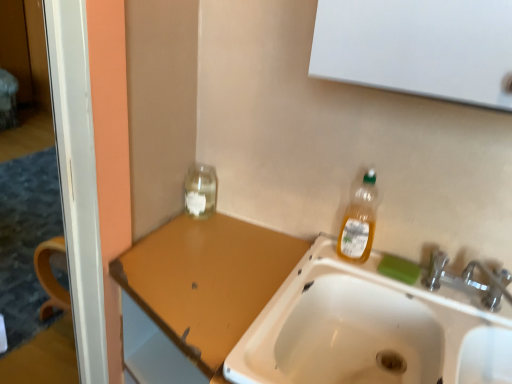
Question: Is green matte bar of soap at sink right in front of or behind white ceramic sink at lower center in the image?

Choices:
 (A) front
 (B) behind

Answer: (B)

Question: In terms of size, does green matte bar of soap at sink right appear bigger or smaller than white ceramic sink at lower center?

Choices:
 (A) small
 (B) big

Answer: (A)

Question: Which object is positioned closest to the white ceramic sink at lower center?

Choices:
 (A) transparent glass jar at upper left
 (B) translucent plastic bottle at upper right
 (C) brown matte counter top at upper left
 (D) green matte bar of soap at sink right

Answer: (D)

Question: Which object is the farthest from the translucent plastic bottle at upper right?

Choices:
 (A) transparent glass jar at upper left
 (B) brown matte counter top at upper left
 (C) green matte bar of soap at sink right
 (D) white ceramic sink at lower center

Answer: (A)